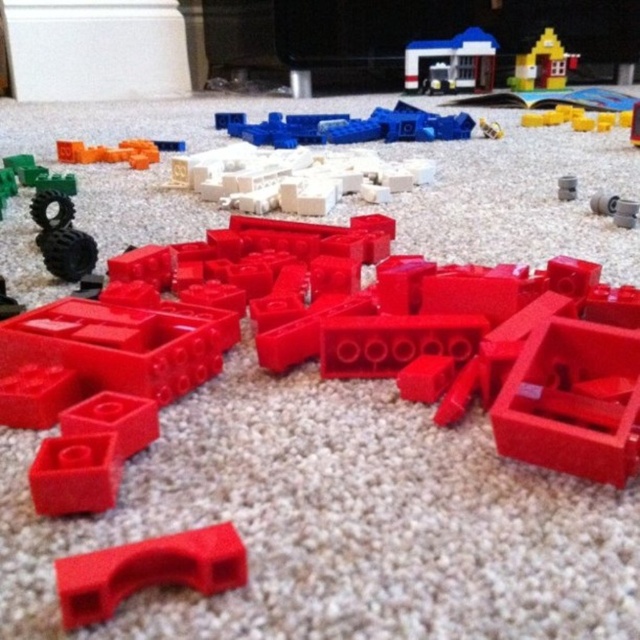
Which is more to the left, translucent blue plastic building at upper center or matte plastic house at upper right?

Positioned to the left is translucent blue plastic building at upper center.

Between translucent blue plastic building at upper center and matte plastic house at upper right, which one is positioned higher?

translucent blue plastic building at upper center

The width and height of the screenshot is (640, 640). In order to click on translucent blue plastic building at upper center in this screenshot , I will do [452, 60].

Describe the element at coordinates (348, 125) in the screenshot. The height and width of the screenshot is (640, 640). I see `matte blue bricks at center` at that location.

Does matte blue bricks at center appear under translucent blue plastic building at upper center?

Yes.

Who is more distant from viewer, (342, 122) or (452, 74)?

Point (452, 74)

The height and width of the screenshot is (640, 640). I want to click on matte blue bricks at center, so click(x=348, y=125).

Is translucent blue plastic building at upper center in front of translucent orange plastic blocks at upper left?

No, it is not.

At what (x,y) coordinates should I click in order to perform the action: click on translucent blue plastic building at upper center. Please return your answer as a coordinate pair (x, y). The image size is (640, 640). Looking at the image, I should click on (452, 60).

Image resolution: width=640 pixels, height=640 pixels. I want to click on translucent blue plastic building at upper center, so click(452, 60).

You are a GUI agent. You are given a task and a screenshot of the screen. Output one action in this format:
    pyautogui.click(x=<x>, y=<y>)
    Task: Click on the translucent blue plastic building at upper center
    This screenshot has height=640, width=640.
    Given the screenshot: What is the action you would take?
    pyautogui.click(x=452, y=60)